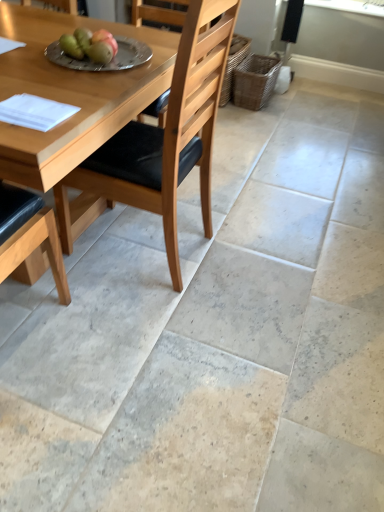
Question: Does light brown wood chair at center come behind green matte apple at upper left, acting as the 2th fruit starting from the right?

Choices:
 (A) no
 (B) yes

Answer: (A)

Question: Does light brown wood chair at center appear on the right side of green matte apple at upper left, the 1th fruit from the left?

Choices:
 (A) yes
 (B) no

Answer: (A)

Question: Does light brown wood chair at center have a greater height compared to green matte apple at upper left, the 1th fruit from the left?

Choices:
 (A) yes
 (B) no

Answer: (A)

Question: Is light brown wood chair at center facing away from green matte apple at upper left, acting as the 2th fruit starting from the right?

Choices:
 (A) yes
 (B) no

Answer: (B)

Question: From the image's perspective, is light brown wood chair at center above green matte apple at upper left, acting as the 2th fruit starting from the right?

Choices:
 (A) no
 (B) yes

Answer: (A)

Question: Considering the positions of woven brown basket at right and silver metallic plate at upper center in the image, is woven brown basket at right taller or shorter than silver metallic plate at upper center?

Choices:
 (A) tall
 (B) short

Answer: (A)

Question: Does point (241, 88) appear closer or farther from the camera than point (72, 62)?

Choices:
 (A) closer
 (B) farther

Answer: (B)

Question: From a real-world perspective, is woven brown basket at right above or below silver metallic plate at upper center?

Choices:
 (A) below
 (B) above

Answer: (A)

Question: Considering the relative positions of woven brown basket at right and silver metallic plate at upper center in the image provided, is woven brown basket at right to the left or to the right of silver metallic plate at upper center?

Choices:
 (A) left
 (B) right

Answer: (B)

Question: Is woven brown basket at right bigger or smaller than green matte pears at upper center, the first fruit in the right-to-left sequence?

Choices:
 (A) big
 (B) small

Answer: (A)

Question: Is woven brown basket at right wider or thinner than green matte pears at upper center, the second fruit from the left?

Choices:
 (A) thin
 (B) wide

Answer: (B)

Question: Visually, is woven brown basket at right positioned to the left or to the right of green matte pears at upper center, the first fruit in the right-to-left sequence?

Choices:
 (A) left
 (B) right

Answer: (B)

Question: From a real-world perspective, relative to green matte pears at upper center, the second fruit from the left, is woven brown basket at right vertically above or below?

Choices:
 (A) below
 (B) above

Answer: (A)

Question: Does point (269, 83) appear closer or farther from the camera than point (84, 53)?

Choices:
 (A) closer
 (B) farther

Answer: (B)

Question: Considering the positions of woven brown basket at right and green matte apple at upper left, the 1th fruit from the left, in the image, is woven brown basket at right wider or thinner than green matte apple at upper left, the 1th fruit from the left,?

Choices:
 (A) wide
 (B) thin

Answer: (A)